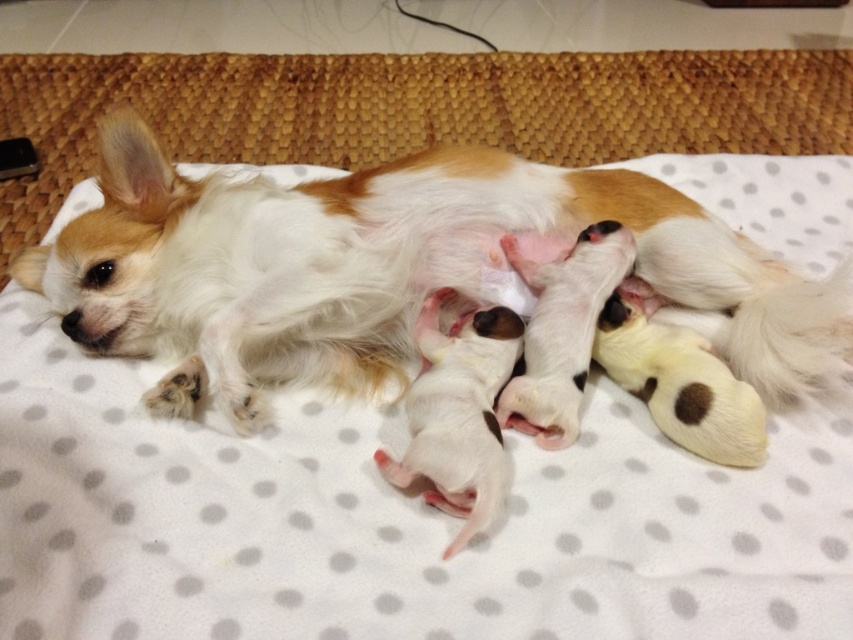
You are a veterinarian examining the image of a dog and puppies. Based on the scene, which object is above the other between the white fur dog at center and the white soft puppies at center?

The white fur dog at center is positioned over the white soft puppies at center, so the dog is above the puppies.

In the scene where a white fur dog at center is surrounded by white soft puppies at center, which group has a bigger size?

The white fur dog at center is larger in size than the white soft puppies at center.